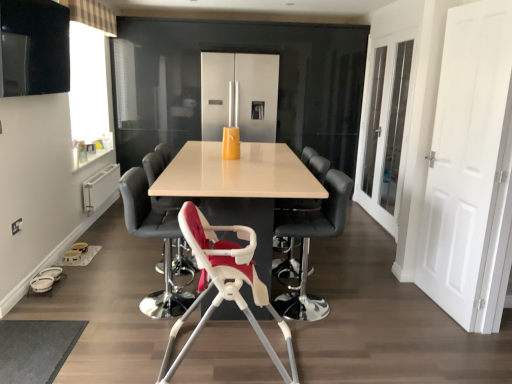
The height and width of the screenshot is (384, 512). Identify the location of free space in front of black leather bar stool at center, placed as the third chair when sorted from front to back. (329, 339).